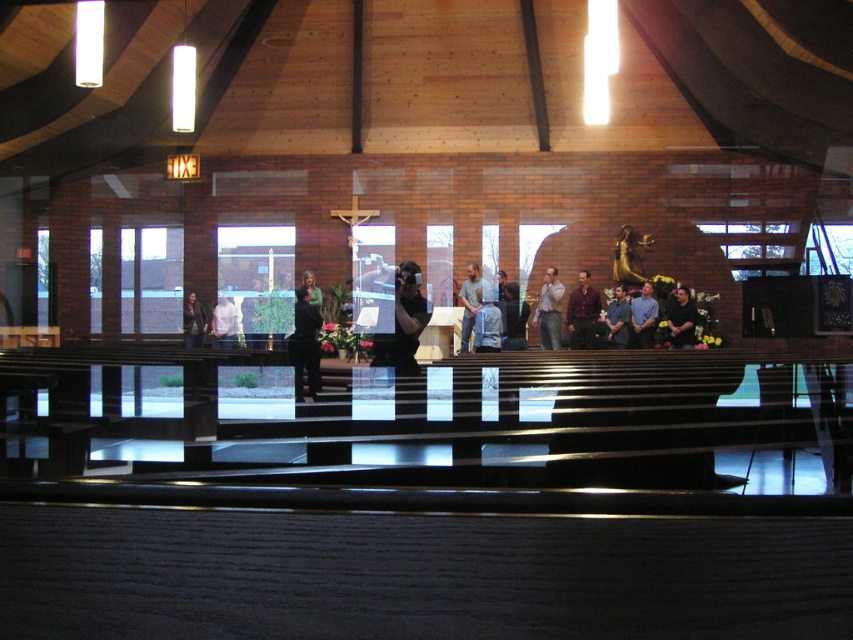
Is dark red shirt at center bigger than white shirt at center?

Indeed, dark red shirt at center has a larger size compared to white shirt at center.

Who is taller, dark red shirt at center or white shirt at center?

With more height is dark red shirt at center.

What do you see at coordinates (582, 312) in the screenshot? This screenshot has height=640, width=853. I see `dark red shirt at center` at bounding box center [582, 312].

Locate an element on the screen. dark red shirt at center is located at coordinates (582, 312).

Can you confirm if dark suit at center is positioned below white shirt at center?

Indeed, dark suit at center is positioned under white shirt at center.

Can you confirm if dark suit at center is positioned to the left of white shirt at center?

Incorrect, dark suit at center is not on the left side of white shirt at center.

The width and height of the screenshot is (853, 640). Describe the element at coordinates (305, 344) in the screenshot. I see `dark suit at center` at that location.

Identify the location of dark suit at center. (305, 344).

Is dark gray shirt at center below white shirt at center?

No.

Where is `dark gray shirt at center`? This screenshot has height=640, width=853. dark gray shirt at center is located at coordinates (514, 317).